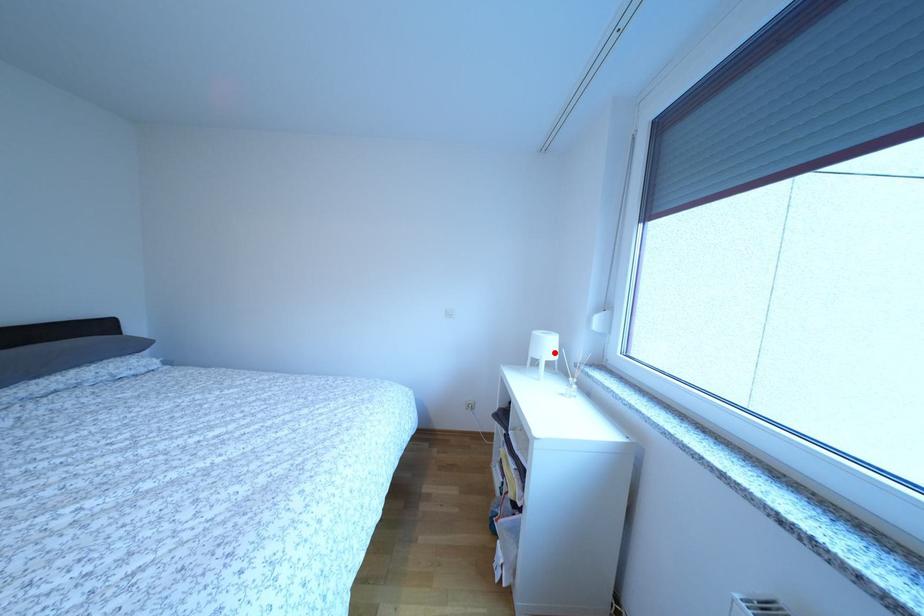
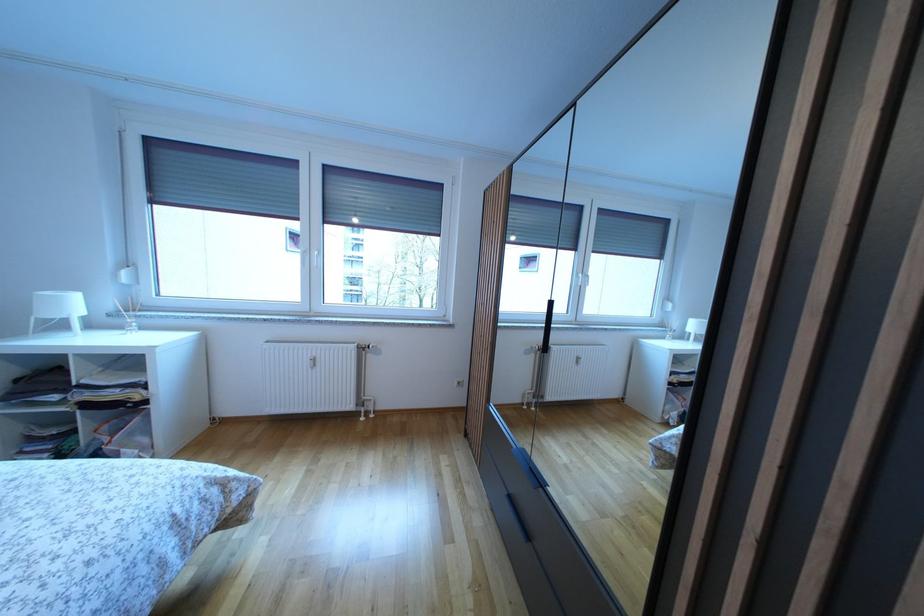
The point at the highlighted location is marked in the first image. Where is the corresponding point in the second image?

(78, 310)